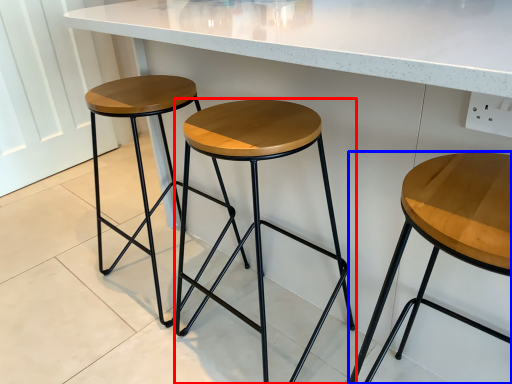
Question: Among these objects, which one is farthest to the camera, stool (highlighted by a red box) or stool (highlighted by a blue box)?

Choices:
 (A) stool
 (B) stool

Answer: (A)